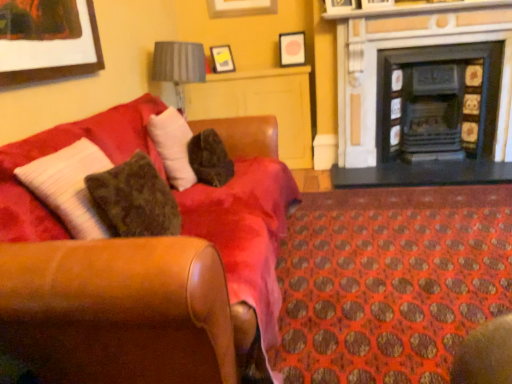
Question: From a real-world perspective, does fuzzy brown pillow at center sit lower than black matte fireplace at right, the 1th fireplace from the right?

Choices:
 (A) no
 (B) yes

Answer: (A)

Question: Does fuzzy brown pillow at center have a smaller size compared to black matte fireplace at right, the 2th fireplace in the left-to-right sequence?

Choices:
 (A) no
 (B) yes

Answer: (B)

Question: From the image's perspective, is fuzzy brown pillow at center on black matte fireplace at right, the 2th fireplace in the left-to-right sequence?

Choices:
 (A) yes
 (B) no

Answer: (B)

Question: Can you confirm if fuzzy brown pillow at center is bigger than black matte fireplace at right, the 2th fireplace in the left-to-right sequence?

Choices:
 (A) yes
 (B) no

Answer: (B)

Question: Can you see fuzzy brown pillow at center touching black matte fireplace at right, the 1th fireplace from the right?

Choices:
 (A) no
 (B) yes

Answer: (A)

Question: Looking at the image, does leather couch at left seem bigger or smaller compared to matte yellow picture frame at upper center, positioned as the 1th picture frame in bottom-to-top order?

Choices:
 (A) small
 (B) big

Answer: (B)

Question: From the image's perspective, is leather couch at left located above or below matte yellow picture frame at upper center, positioned as the 1th picture frame in bottom-to-top order?

Choices:
 (A) above
 (B) below

Answer: (B)

Question: In terms of height, does leather couch at left look taller or shorter compared to matte yellow picture frame at upper center, which ranks as the 3th picture frame in top-to-bottom order?

Choices:
 (A) tall
 (B) short

Answer: (A)

Question: Would you say leather couch at left is to the left or to the right of matte yellow picture frame at upper center, which ranks as the 3th picture frame in top-to-bottom order, in the picture?

Choices:
 (A) right
 (B) left

Answer: (B)

Question: Does point (193, 172) appear closer or farther from the camera than point (285, 119)?

Choices:
 (A) closer
 (B) farther

Answer: (A)

Question: Based on their positions, is fuzzy brown pillow at center located to the left or right of wooden cabinet at center?

Choices:
 (A) right
 (B) left

Answer: (B)

Question: Looking at their shapes, would you say fuzzy brown pillow at center is wider or thinner than wooden cabinet at center?

Choices:
 (A) wide
 (B) thin

Answer: (B)

Question: Considering the positions of fuzzy brown pillow at center and wooden cabinet at center in the image, is fuzzy brown pillow at center taller or shorter than wooden cabinet at center?

Choices:
 (A) short
 (B) tall

Answer: (A)

Question: Looking at the image, does gray fabric lampshade at upper center seem bigger or smaller compared to matte yellow picture frame at upper center, which ranks as the 3th picture frame in top-to-bottom order?

Choices:
 (A) small
 (B) big

Answer: (B)

Question: In terms of width, does gray fabric lampshade at upper center look wider or thinner when compared to matte yellow picture frame at upper center, positioned as the 1th picture frame in bottom-to-top order?

Choices:
 (A) wide
 (B) thin

Answer: (A)